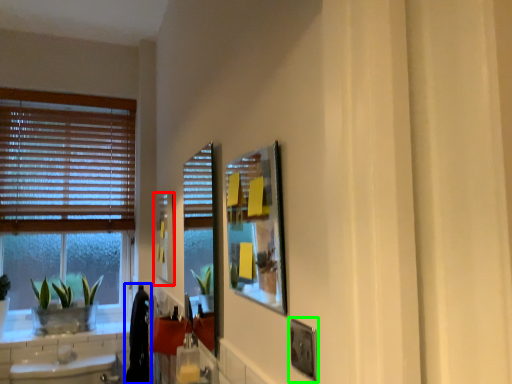
Question: Which object is positioned farthest from picture frame (highlighted by a red box)? Select from laundry (highlighted by a blue box) and picture frame (highlighted by a green box).

Choices:
 (A) laundry
 (B) picture frame

Answer: (B)